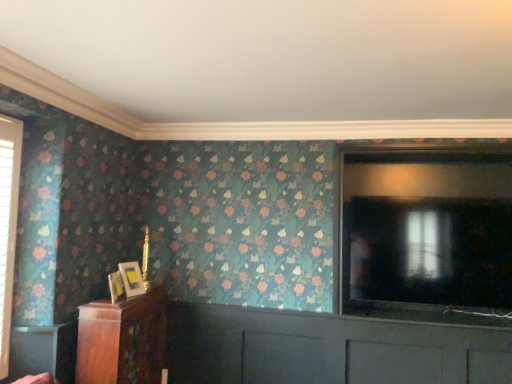
Question: Does point (62, 362) appear closer or farther from the camera than point (475, 107)?

Choices:
 (A) farther
 (B) closer

Answer: (A)

Question: In terms of width, does wooden table at lower left look wider or thinner when compared to white matte ceiling at upper center?

Choices:
 (A) wide
 (B) thin

Answer: (B)

Question: Based on their relative distances, which object is nearer to the wooden cabinet at lower left?

Choices:
 (A) white matte ceiling at upper center
 (B) wooden table at lower left
 (C) matte gold picture frame at left, the 1th picture frame positioned from the front
 (D) matte gold picture frame at lower left, acting as the 2th picture frame starting from the front
 (E) transparent glass screen door at right

Answer: (B)

Question: Which object is positioned closest to the transparent glass screen door at right?

Choices:
 (A) matte gold picture frame at left, the 1th picture frame positioned from the front
 (B) matte gold picture frame at lower left, the first picture frame viewed from the back
 (C) wooden cabinet at lower left
 (D) wooden table at lower left
 (E) white matte ceiling at upper center

Answer: (E)